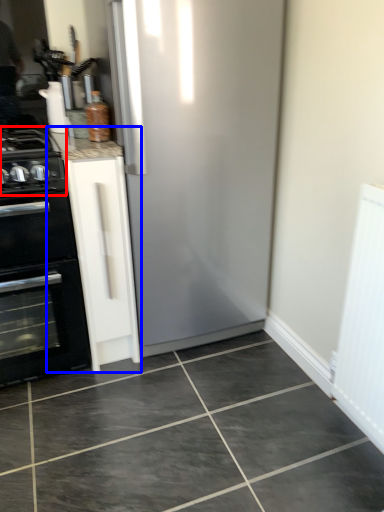
Question: Which of the following is the farthest to the observer, gas stove (highlighted by a red box) or cabinetry (highlighted by a blue box)?

Choices:
 (A) gas stove
 (B) cabinetry

Answer: (B)